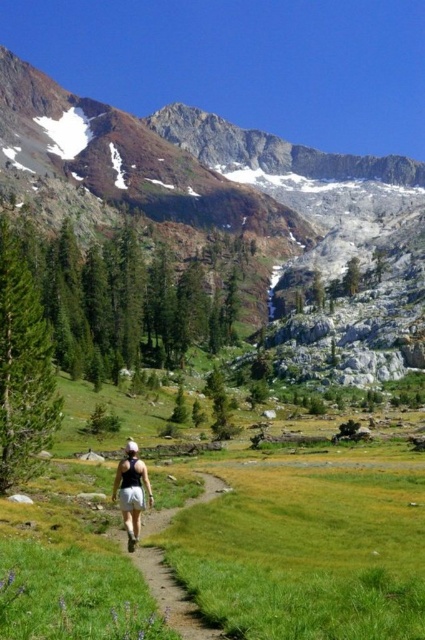
Which is below, rocky gray mountain at upper center or white cotton shorts at center?

Positioned lower is white cotton shorts at center.

Describe the element at coordinates (240, 211) in the screenshot. I see `rocky gray mountain at upper center` at that location.

You are a GUI agent. You are given a task and a screenshot of the screen. Output one action in this format:
    pyautogui.click(x=<x>, y=<y>)
    Task: Click on the rocky gray mountain at upper center
    The image size is (425, 640).
    Given the screenshot: What is the action you would take?
    pyautogui.click(x=240, y=211)

Looking at this image, who is positioned more to the right, green grassy field at center or rocky gray mountain at upper center?

green grassy field at center is more to the right.

Is green grassy field at center to the right of rocky gray mountain at upper center from the viewer's perspective?

Yes, green grassy field at center is to the right of rocky gray mountain at upper center.

Where is `green grassy field at center`? green grassy field at center is located at coordinates (302, 540).

Where is `green grassy field at center`? green grassy field at center is located at coordinates (302, 540).

Based on the photo, between green grassy field at center and white cotton shorts at center, which one is positioned higher?

Positioned higher is white cotton shorts at center.

Which of these two, green grassy field at center or white cotton shorts at center, stands taller?

white cotton shorts at center

Locate an element on the screen. green grassy field at center is located at coordinates (302, 540).